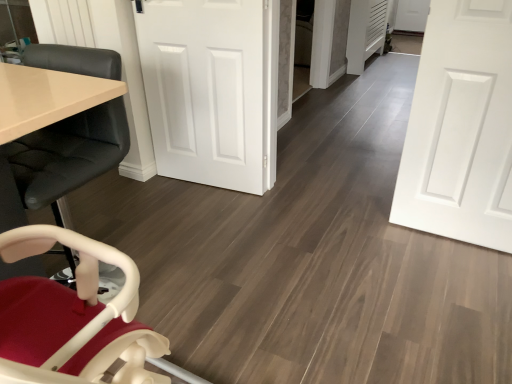
Where is `free spot behind matte black chair at left`? Image resolution: width=512 pixels, height=384 pixels. free spot behind matte black chair at left is located at coordinates (135, 226).